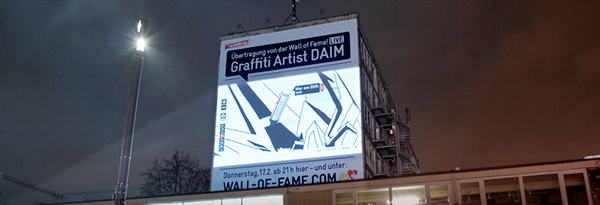
Identify the location of spiral staircase. (406, 163).